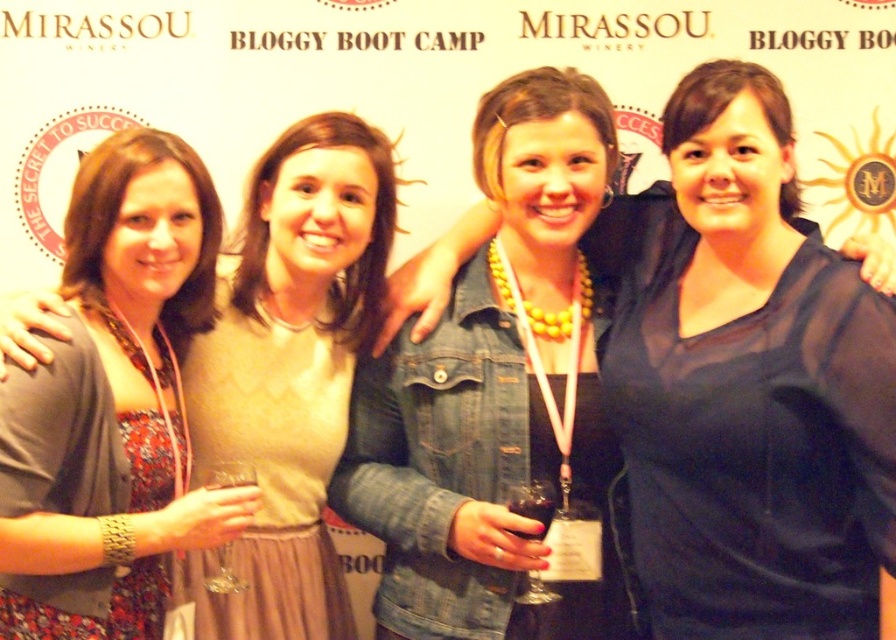
How distant is translucent glass wine at center from clear glass wine glass at lower left?

translucent glass wine at center is 3.19 meters away from clear glass wine glass at lower left.

Does translucent glass wine at center have a lesser width compared to clear glass wine glass at lower left?

Incorrect, translucent glass wine at center's width is not less than clear glass wine glass at lower left's.

Between point (524, 490) and point (205, 483), which one is positioned in front?

Point (205, 483)

You are a GUI agent. You are given a task and a screenshot of the screen. Output one action in this format:
    pyautogui.click(x=<x>, y=<y>)
    Task: Click on the translucent glass wine at center
    The image size is (896, 640).
    Given the screenshot: What is the action you would take?
    pyautogui.click(x=531, y=506)

Based on the photo, which of these two, denim jacket at center or dark red glass at center, stands taller?

denim jacket at center is taller.

Between denim jacket at center and dark red glass at center, which one has less height?

With less height is dark red glass at center.

At what (x,y) coordinates should I click in order to perform the action: click on denim jacket at center. Please return your answer as a coordinate pair (x, y). This screenshot has height=640, width=896. Looking at the image, I should click on (728, 392).

Which of these two, translucent glass wine at center or dark red glass at center, stands shorter?

dark red glass at center is shorter.

Between point (537, 588) and point (541, 518), which one is positioned behind?

Point (541, 518)

Where is `translucent glass wine at center`? Image resolution: width=896 pixels, height=640 pixels. translucent glass wine at center is located at coordinates (531, 506).